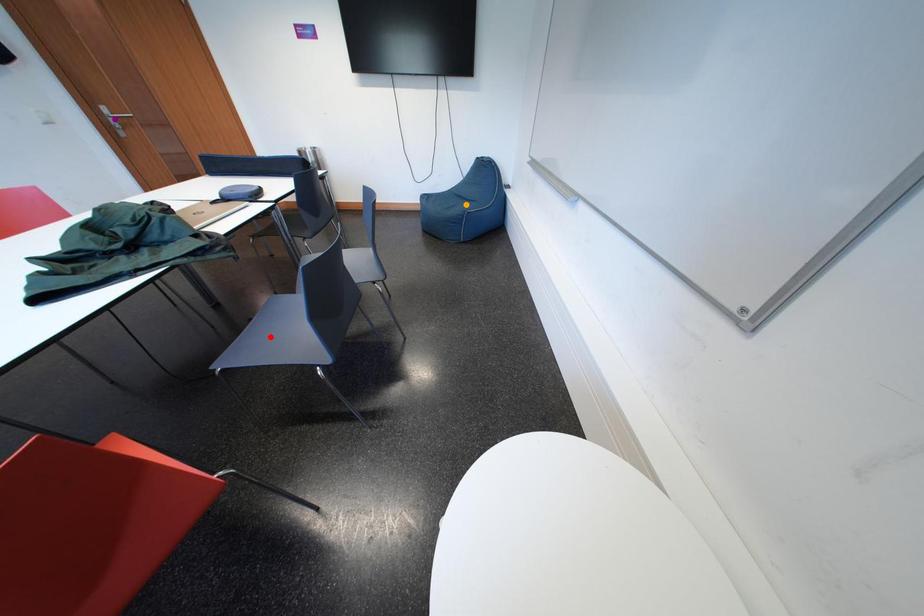
Order these from nearest to farthest:
1. red point
2. orange point
3. purple point

orange point < purple point < red point